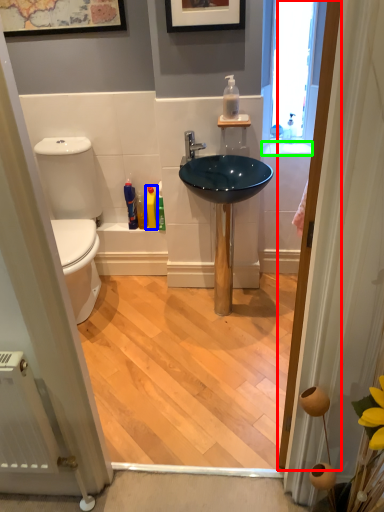
Question: Which object is the farthest from door (highlighted by a red box)? Choose among these: toiletry (highlighted by a blue box) or counter top (highlighted by a green box).

Choices:
 (A) toiletry
 (B) counter top

Answer: (A)